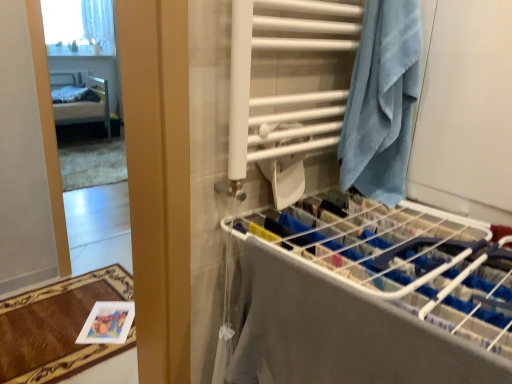
What is the approximate width of blue terry cloth towel at right?

blue terry cloth towel at right is 9.20 inches in width.

This screenshot has width=512, height=384. What do you see at coordinates (99, 24) in the screenshot? I see `white sheer curtain at upper left` at bounding box center [99, 24].

This screenshot has height=384, width=512. What are the coordinates of `brown plush bath mat at lower left` in the screenshot? It's located at (58, 327).

Based on the photo, from a real-world perspective, who is located higher, blue terry cloth towel at right or clear glass mirror at left?

In real-world perspective, blue terry cloth towel at right is above.

Between blue terry cloth towel at right and clear glass mirror at left, which one has less height?

Standing shorter between the two is blue terry cloth towel at right.

In the scene shown: Considering the sizes of blue terry cloth towel at right and clear glass mirror at left in the image, is blue terry cloth towel at right wider or thinner than clear glass mirror at left?

In the image, blue terry cloth towel at right appears to be more narrow than clear glass mirror at left.

Considering the positions of point (360, 130) and point (66, 170), is point (360, 130) closer or farther from the camera than point (66, 170)?

Point (360, 130) is positioned closer to the camera compared to point (66, 170).

Is point (101, 42) more distant than point (290, 265)?

Yes, it is behind point (290, 265).

Where is `closet beneath the white sheer curtain at upper left (from a real-world perspective)`? closet beneath the white sheer curtain at upper left (from a real-world perspective) is located at coordinates (362, 294).

Measure the distance between white sheer curtain at upper left and white plastic drying rack at center right.

white sheer curtain at upper left is 5.41 meters from white plastic drying rack at center right.

Who is bigger, white sheer curtain at upper left or white plastic drying rack at center right?

white plastic drying rack at center right.

Who is shorter, white sheer curtain at upper left or brown plush bath mat at lower left?

brown plush bath mat at lower left is shorter.

Which object is thinner, white sheer curtain at upper left or brown plush bath mat at lower left?

white sheer curtain at upper left.

Is point (109, 30) closer or farther from the camera than point (5, 334)?

Point (109, 30) is positioned farther from the camera compared to point (5, 334).

Is white sheer curtain at upper left positioned far away from brown plush bath mat at lower left?

white sheer curtain at upper left is positioned a significant distance from brown plush bath mat at lower left.

Considering the relative sizes of blue towel at right and blue terry cloth towel at right in the image provided, is blue towel at right smaller than blue terry cloth towel at right?

No.

Can you confirm if blue towel at right is taller than blue terry cloth towel at right?

Yes, blue towel at right is taller than blue terry cloth towel at right.

What's the angular difference between blue towel at right and blue terry cloth towel at right's facing directions?

The angular difference between blue towel at right and blue terry cloth towel at right is 1.24 degrees.

Can you confirm if blue towel at right is wider than blue terry cloth towel at right?

Yes.

Is white sheer curtain at upper left oriented away from blue towel at right?

No, white sheer curtain at upper left is not facing the opposite direction of blue towel at right.

From the image's perspective, is white sheer curtain at upper left on top of blue towel at right?

Indeed, from the image's perspective, white sheer curtain at upper left is shown above blue towel at right.

Considering the relative sizes of white sheer curtain at upper left and blue towel at right in the image provided, is white sheer curtain at upper left thinner than blue towel at right?

Correct, the width of white sheer curtain at upper left is less than that of blue towel at right.

From a real-world perspective, who is located lower, white sheer curtain at upper left or clear glass mirror at left?

clear glass mirror at left is physically lower.

Can you confirm if white sheer curtain at upper left is wider than clear glass mirror at left?

No, white sheer curtain at upper left is not wider than clear glass mirror at left.

Is white sheer curtain at upper left far away from clear glass mirror at left?

No, there isn't a large distance between white sheer curtain at upper left and clear glass mirror at left.

Is blue terry cloth towel at right oriented towards metallic silver bed at left?

No, blue terry cloth towel at right is not facing towards metallic silver bed at left.

Is blue terry cloth towel at right touching metallic silver bed at left?

No, blue terry cloth towel at right is not with metallic silver bed at left.

From the picture: Considering the relative sizes of blue terry cloth towel at right and metallic silver bed at left in the image provided, is blue terry cloth towel at right thinner than metallic silver bed at left?

Indeed, blue terry cloth towel at right has a lesser width compared to metallic silver bed at left.

Is blue terry cloth towel at right bigger than metallic silver bed at left?

Incorrect, blue terry cloth towel at right is not larger than metallic silver bed at left.

Identify the location of mirror behind the blue terry cloth towel at right. This screenshot has height=384, width=512. (86, 87).

Identify the location of closet below the white sheer curtain at upper left (from a real-world perspective). This screenshot has height=384, width=512. (362, 294).

Considering their positions, is clear glass mirror at left positioned closer to blue terry cloth towel at right than white sheer curtain at upper left?

The object closer to blue terry cloth towel at right is clear glass mirror at left.

Estimate the real-world distances between objects in this image. Which object is closer to white sheer curtain at upper left, clear glass mirror at left or blue terry cloth towel at right?

The object closer to white sheer curtain at upper left is clear glass mirror at left.

Considering their positions, is clear glass mirror at left positioned closer to brown plush bath mat at lower left than blue towel at right?

blue towel at right lies closer to brown plush bath mat at lower left than the other object.

From the picture: Estimate the real-world distances between objects in this image. Which object is further from white plastic drying rack at center right, blue terry cloth towel at right or clear glass mirror at left?

clear glass mirror at left is further to white plastic drying rack at center right.

Based on the photo, looking at the image, which one is located closer to white plastic drying rack at center right, blue towel at right or brown plush bath mat at lower left?

The object closer to white plastic drying rack at center right is blue towel at right.

Looking at the image, which one is located closer to white sheer curtain at upper left, brown plush bath mat at lower left or blue terry cloth towel at right?

brown plush bath mat at lower left lies closer to white sheer curtain at upper left than the other object.

Considering their positions, is brown plush bath mat at lower left positioned closer to white plastic drying rack at center right than metallic silver bed at left?

Among the two, brown plush bath mat at lower left is located nearer to white plastic drying rack at center right.

Which object lies further to the anchor point blue terry cloth towel at right, blue towel at right or metallic silver bed at left?

metallic silver bed at left is positioned further to the anchor blue terry cloth towel at right.

Where is `beach towel between white plastic drying rack at center right and white sheer curtain at upper left along the z-axis`? beach towel between white plastic drying rack at center right and white sheer curtain at upper left along the z-axis is located at coordinates [381, 102].

Identify the location of mirror between white plastic drying rack at center right and metallic silver bed at left in the front-back direction. 86,87.

This screenshot has width=512, height=384. Find the location of `screen door between white plastic drying rack at center right and white sheer curtain at upper left along the z-axis`. screen door between white plastic drying rack at center right and white sheer curtain at upper left along the z-axis is located at coordinates (465, 110).

Identify the location of beach towel between white plastic drying rack at center right and metallic silver bed at left in the front-back direction. Image resolution: width=512 pixels, height=384 pixels. (381, 102).